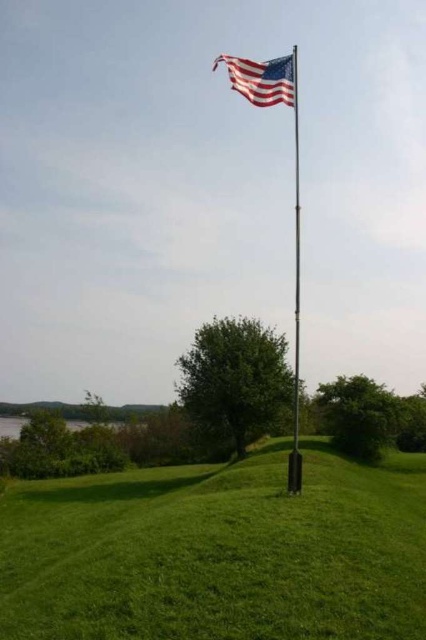
Question: Which point is closer to the camera?

Choices:
 (A) (146, 483)
 (B) (293, 93)

Answer: (B)

Question: Which object appears closest to the camera in this image?

Choices:
 (A) green grass at center
 (B) metallic flag pole at center

Answer: (A)

Question: Does green grass at center appear under american flag at upper center?

Choices:
 (A) yes
 (B) no

Answer: (A)

Question: Which point appears closest to the camera in this image?

Choices:
 (A) (276, 97)
 (B) (296, 51)
 (C) (417, 584)

Answer: (C)

Question: Can you confirm if american flag at upper center is smaller than metallic flag pole at center?

Choices:
 (A) yes
 (B) no

Answer: (A)

Question: Is green grass at center to the right of american flag at upper center from the viewer's perspective?

Choices:
 (A) no
 (B) yes

Answer: (B)